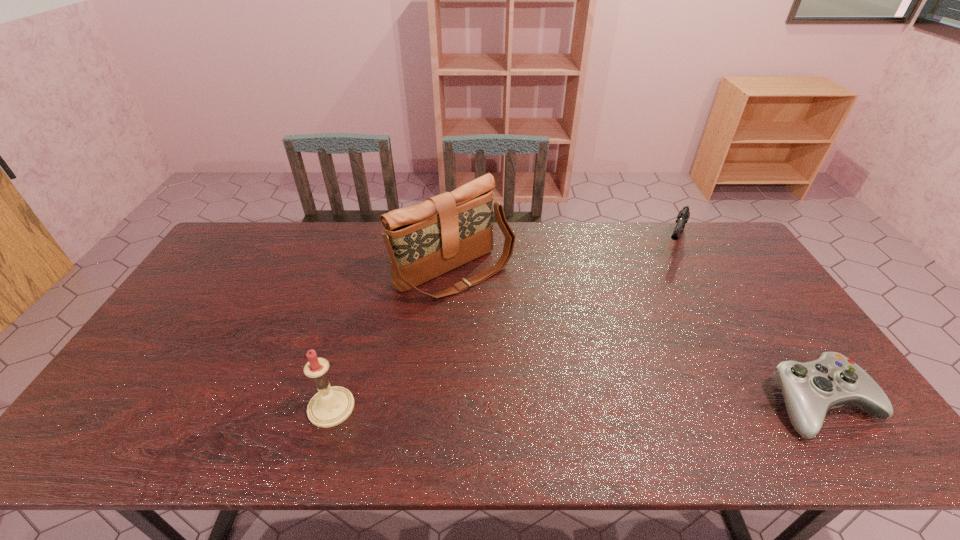
Find the location of a particular element. The height and width of the screenshot is (540, 960). blank space located on the front-facing side of the shoulder bag is located at coordinates (551, 352).

Image resolution: width=960 pixels, height=540 pixels. Identify the location of blank space located 0.380m at the end of the barrel of the third tallest object. (644, 335).

Where is `vacant space situated at the end of the barrel of the third tallest object`? vacant space situated at the end of the barrel of the third tallest object is located at coordinates (660, 295).

This screenshot has height=540, width=960. In order to click on free location located at the end of the barrel of the third tallest object in this screenshot , I will do `click(660, 295)`.

Locate an element on the screen. Image resolution: width=960 pixels, height=540 pixels. shoulder bag at the far edge is located at coordinates (426, 240).

Find the location of `gun present at the far edge`. gun present at the far edge is located at coordinates (683, 216).

Find the location of a particular element. candle that is at the near edge is located at coordinates (331, 406).

I want to click on control that is at the near edge, so click(810, 389).

Locate an element on the screen. The width and height of the screenshot is (960, 540). control located at the right edge is located at coordinates (810, 389).

Find the location of a particular element. The height and width of the screenshot is (540, 960). gun that is at the right edge is located at coordinates (683, 216).